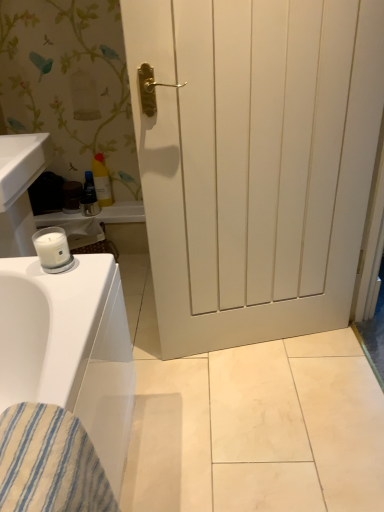
Question: From a real-world perspective, relative to blue glossy tube at center, the second toiletry when ordered from right to left, is white matte door at center vertically above or below?

Choices:
 (A) above
 (B) below

Answer: (A)

Question: Is white matte door at center inside the boundaries of blue glossy tube at center, the second toiletry when ordered from right to left, or outside?

Choices:
 (A) inside
 (B) outside

Answer: (B)

Question: Which is farther from the blue striped fabric at lower left?

Choices:
 (A) white matte door at center
 (B) yellow plastic bottle at upper left, the first toiletry from the right
 (C) blue glossy tube at center, which is the first toiletry in left-to-right order

Answer: (B)

Question: Considering the real-world distances, which object is closest to the blue glossy tube at center, which is the first toiletry in left-to-right order?

Choices:
 (A) white matte door at center
 (B) blue striped fabric at lower left
 (C) yellow plastic bottle at upper left, the second toiletry in the left-to-right sequence

Answer: (C)